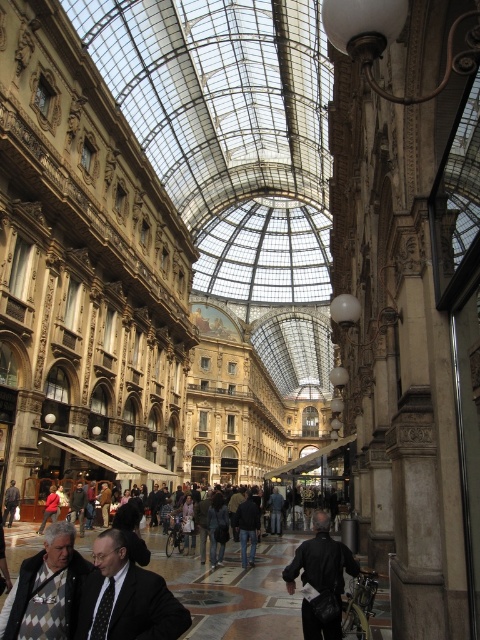
You are a tailor who needs to determine which garment requires more fabric to repair. You see a knitted sweater at lower left and a dark gray jacket at center. Which one likely needs more fabric?

The knitted sweater at lower left is bigger than the dark gray jacket at center, so it likely requires more fabric for repairs.